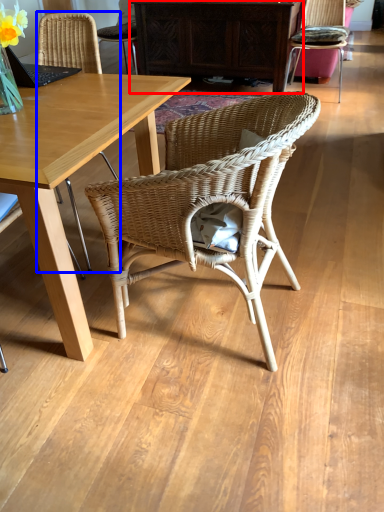
Question: Among these objects, which one is farthest to the camera, cabinetry (highlighted by a red box) or chair (highlighted by a blue box)?

Choices:
 (A) cabinetry
 (B) chair

Answer: (A)